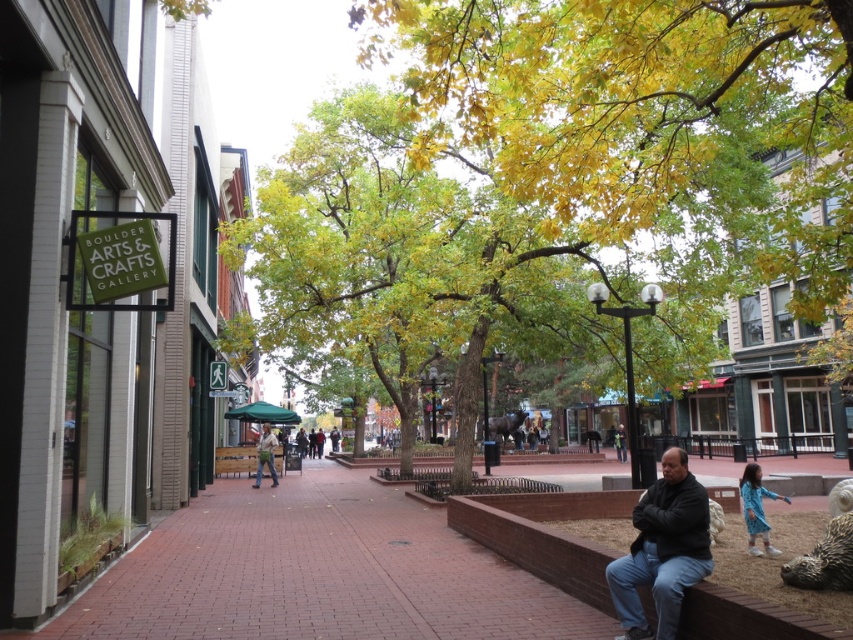
You are a photographer standing in the pedestrian area and want to take a photo of both the blue cotton dress at lower right and the khaki cotton shirt at center. Which item should you focus on first to ensure both are in the frame without moving the camera?

The blue cotton dress at lower right is located above the khaki cotton shirt at center, so you should focus on the blue cotton dress at lower right first to ensure both are in the frame without moving the camera.

You are a fashion designer walking through the urban area and see the blue cotton dress at lower right and the khaki cotton shirt at center. Which clothing item is smaller in size?

The blue cotton dress at lower right has a smaller size compared to the khaki cotton shirt at center.